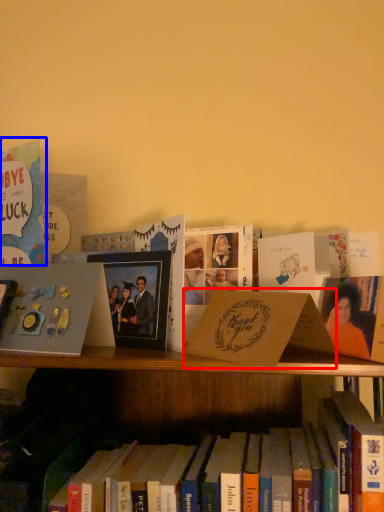
Question: Which of the following is the farthest to the observer, paperback book (highlighted by a red box) or book (highlighted by a blue box)?

Choices:
 (A) paperback book
 (B) book

Answer: (B)